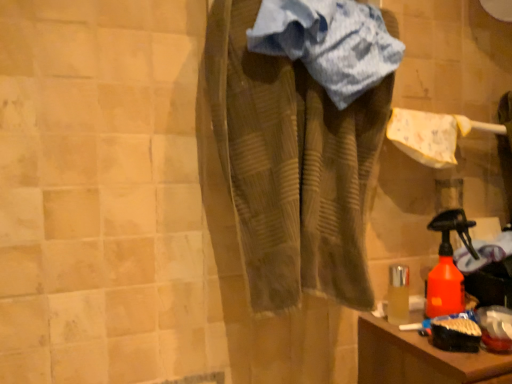
Question: Does brown textured towel at center have a lesser height compared to blue striped towel at center?

Choices:
 (A) yes
 (B) no

Answer: (B)

Question: Can we say brown textured towel at center lies outside blue striped towel at center?

Choices:
 (A) no
 (B) yes

Answer: (B)

Question: Does brown textured towel at center have a smaller size compared to blue striped towel at center?

Choices:
 (A) yes
 (B) no

Answer: (B)

Question: From the image's perspective, does brown textured towel at center appear lower than blue striped towel at center?

Choices:
 (A) no
 (B) yes

Answer: (B)

Question: From a real-world perspective, is brown textured towel at center located beneath blue striped towel at center?

Choices:
 (A) no
 (B) yes

Answer: (B)

Question: From the image's perspective, would you say brown textured towel at center is positioned over blue striped towel at center?

Choices:
 (A) no
 (B) yes

Answer: (A)

Question: Is orange matte spray bottle at lower right facing towards blue striped towel at center?

Choices:
 (A) no
 (B) yes

Answer: (A)

Question: Are orange matte spray bottle at lower right and blue striped towel at center located far from each other?

Choices:
 (A) no
 (B) yes

Answer: (A)

Question: Is orange matte spray bottle at lower right further to camera compared to blue striped towel at center?

Choices:
 (A) yes
 (B) no

Answer: (A)

Question: Does orange matte spray bottle at lower right have a greater height compared to blue striped towel at center?

Choices:
 (A) no
 (B) yes

Answer: (A)

Question: From the image's perspective, is orange matte spray bottle at lower right on blue striped towel at center?

Choices:
 (A) yes
 (B) no

Answer: (B)

Question: Can you confirm if orange matte spray bottle at lower right is positioned to the left of blue striped towel at center?

Choices:
 (A) yes
 (B) no

Answer: (B)

Question: Is brown textured towel at center further to camera compared to orange matte spray bottle at lower right?

Choices:
 (A) yes
 (B) no

Answer: (B)